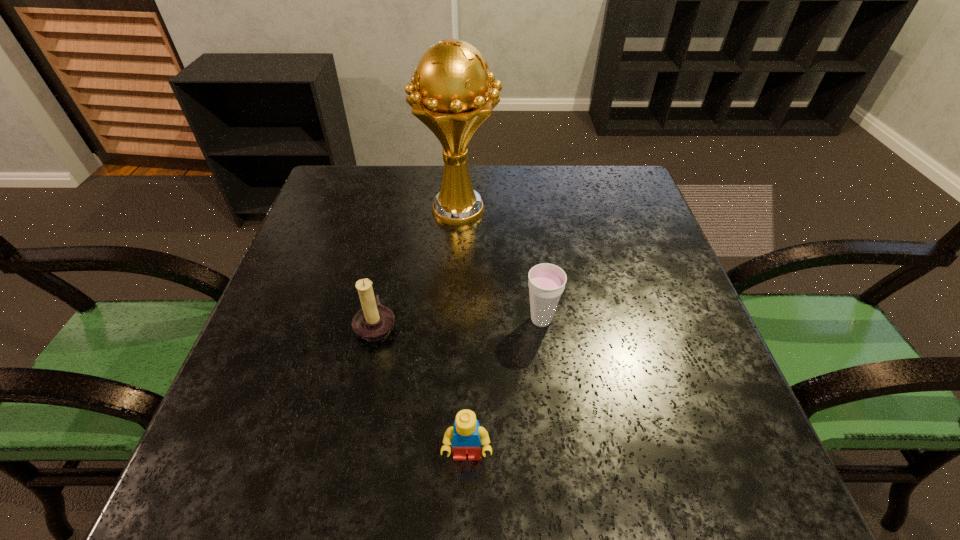
What are the coordinates of `vacant point that satisfies the following two spatial constraints: 1. at the front of the farthest object where the globe is prominent; 2. on the left side of the rightmost object` in the screenshot? It's located at (452, 320).